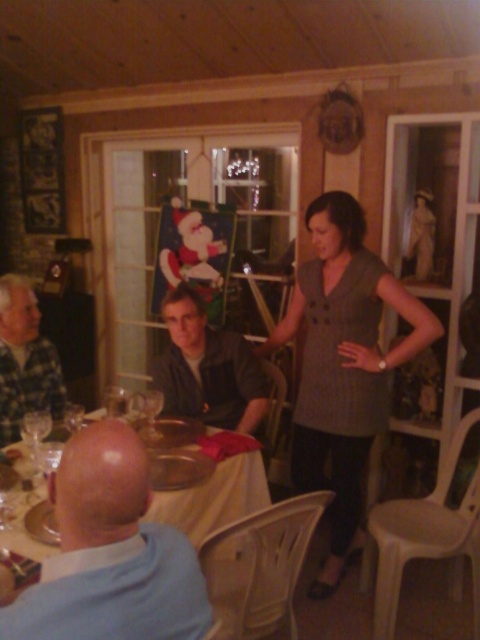
Is point (397, 284) positioned before point (24, 337)?

Yes, point (397, 284) is in front of point (24, 337).

Who is taller, gray textured dress at center or plaid fabric shirt at left?

gray textured dress at center is taller.

Between point (305, 404) and point (17, 408), which one is positioned in front?

Point (17, 408) is in front.

Identify the location of gray textured dress at center. (343, 364).

Measure the distance between gray textured dress at center and camera.

gray textured dress at center and camera are 2.22 meters apart.

Is point (400, 346) closer to viewer compared to point (160, 401)?

No.

Where is `gray textured dress at center`? The width and height of the screenshot is (480, 640). gray textured dress at center is located at coordinates (343, 364).

Does blue cotton shirt at lower left lie in front of dark gray fabric shirt at center?

That is True.

Who is more distant from viewer, (144, 477) or (169, 384)?

Positioned behind is point (169, 384).

Is point (168, 589) positioned after point (168, 403)?

No, (168, 589) is in front of (168, 403).

Find the location of a particular element. This screenshot has width=480, height=640. blue cotton shirt at lower left is located at coordinates (109, 554).